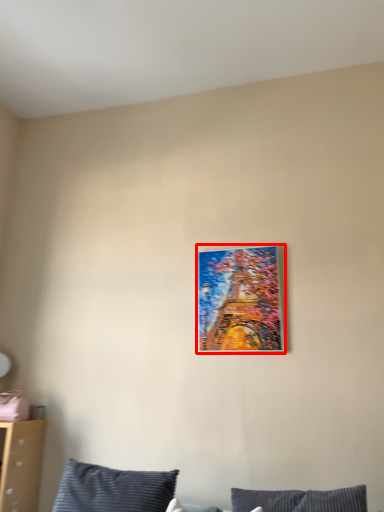
Question: Observing the image, what is the correct spatial positioning of picture frame (annotated by the red box) in reference to pillow?

Choices:
 (A) right
 (B) left

Answer: (A)